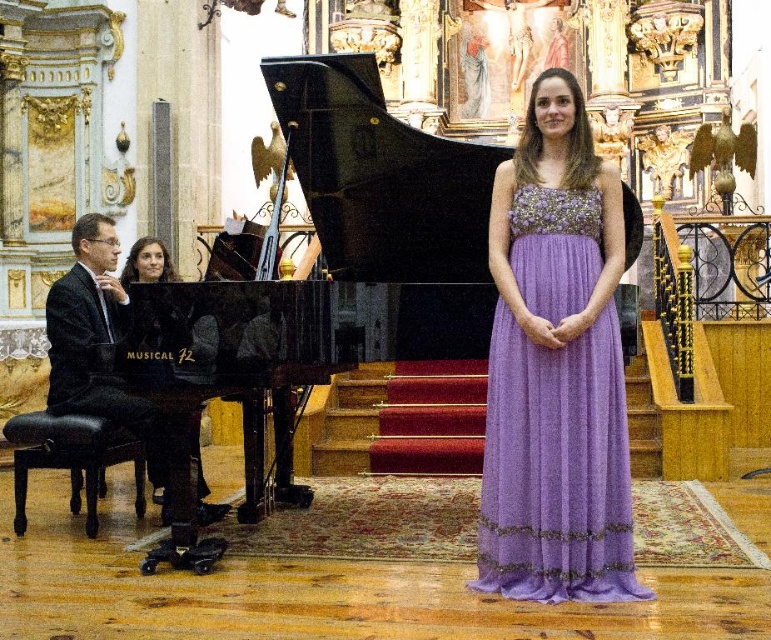
Is lavender chiffon dress at center bigger than black glossy suit at left?

No, lavender chiffon dress at center is not bigger than black glossy suit at left.

Who is more distant from viewer, (556, 449) or (153, 417)?

Positioned behind is point (153, 417).

You are a GUI agent. You are given a task and a screenshot of the screen. Output one action in this format:
    pyautogui.click(x=<x>, y=<y>)
    Task: Click on the lavender chiffon dress at center
    This screenshot has width=771, height=640.
    Given the screenshot: What is the action you would take?
    pyautogui.click(x=556, y=467)

From the picture: Who is lower down, black glossy suit at left or matte black piano at left?

A: black glossy suit at left

Does black glossy suit at left appear on the left side of matte black piano at left?

Yes, black glossy suit at left is to the left of matte black piano at left.

Is point (88, 227) more distant than point (133, 266)?

No, it is in front of (133, 266).

Where is `black glossy suit at left`? Image resolution: width=771 pixels, height=640 pixels. black glossy suit at left is located at coordinates (98, 346).

From the picture: Does black glossy suit at left have a smaller size compared to black leather stool at lower left?

No, black glossy suit at left is not smaller than black leather stool at lower left.

Does black glossy suit at left come behind black leather stool at lower left?

No, black glossy suit at left is closer to the viewer.

What do you see at coordinates (98, 346) in the screenshot?
I see `black glossy suit at left` at bounding box center [98, 346].

At what (x,y) coordinates should I click in order to perform the action: click on black glossy suit at left. Please return your answer as a coordinate pair (x, y). Looking at the image, I should click on (98, 346).